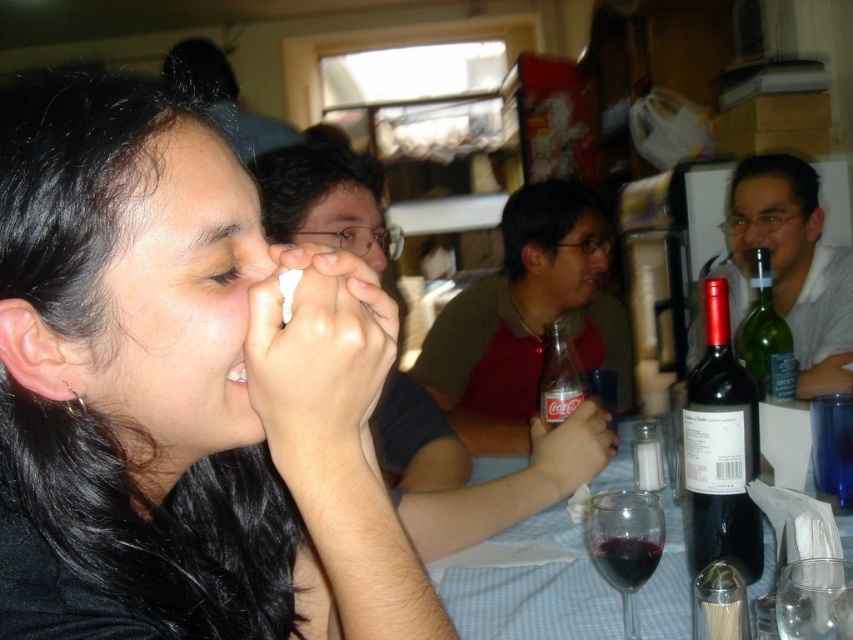
Question: Among these objects, which one is nearest to the camera?

Choices:
 (A) transparent glass at lower right
 (B) green glass bottle at right

Answer: (A)

Question: Among these objects, which one is nearest to the camera?

Choices:
 (A) clear glass coca-cola bottle at center
 (B) transparent glass of red wine at lower center

Answer: (B)

Question: Is the position of transparent glass at lower center less distant than that of green glass bottle at right?

Choices:
 (A) no
 (B) yes

Answer: (B)

Question: In this image, where is black matte wine bottle at right located relative to transparent glass at lower right?

Choices:
 (A) below
 (B) above

Answer: (B)

Question: Is black matte hair at upper left thinner than transparent glass at lower center?

Choices:
 (A) no
 (B) yes

Answer: (A)

Question: Estimate the real-world distances between objects in this image. Which object is closer to the transparent glass at lower right?

Choices:
 (A) translucent glass wine at center
 (B) transparent glass of red wine at lower center
 (C) transparent glass at lower center

Answer: (B)